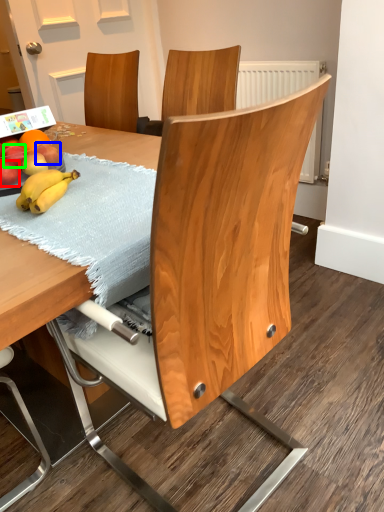
Question: Which object is the closest to the apple (highlighted by a red box)? Choose among these: apple (highlighted by a blue box) or apple (highlighted by a green box).

Choices:
 (A) apple
 (B) apple

Answer: (B)